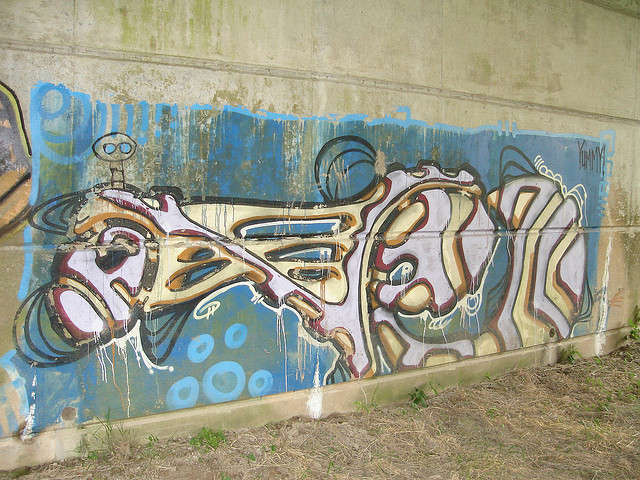
Where is `white streaks running down wall`? white streaks running down wall is located at coordinates (600, 324), (323, 403), (35, 417).